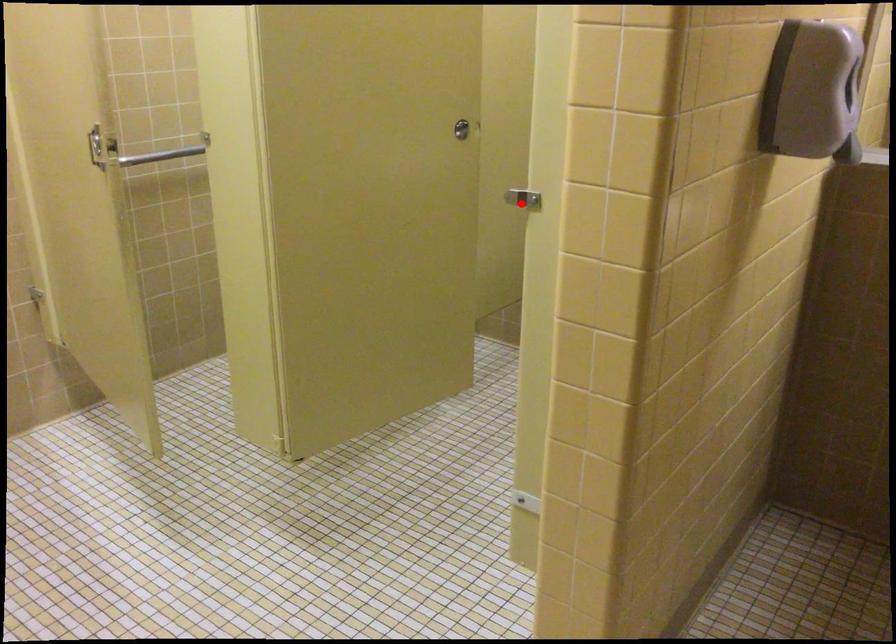
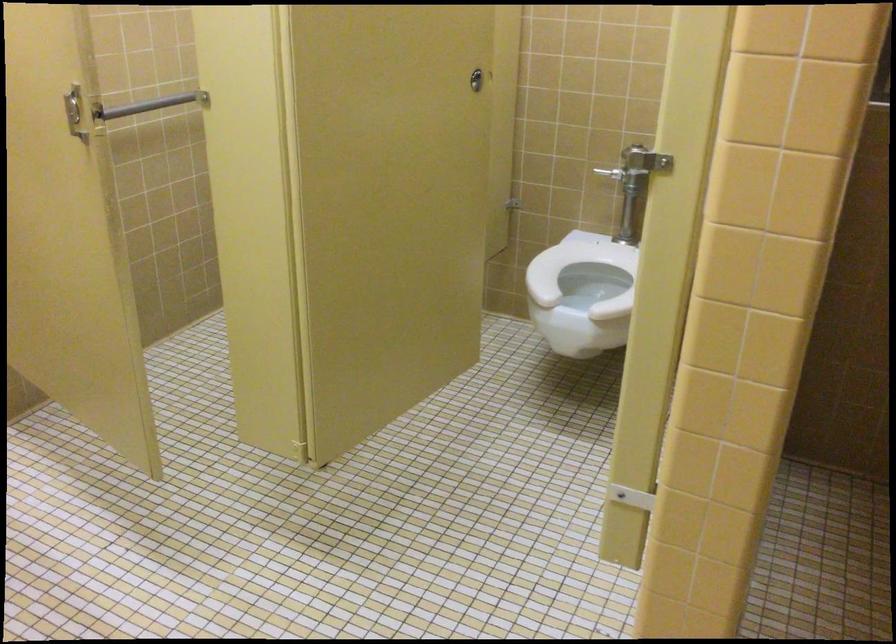
Question: I am providing you with two images of the same scene from different viewpoints. Given a red point in image1, look at the same physical point in image2. Is it:

Choices:
 (A) Closer to the viewpoint
 (B) Farther from the viewpoint

Answer: (A)